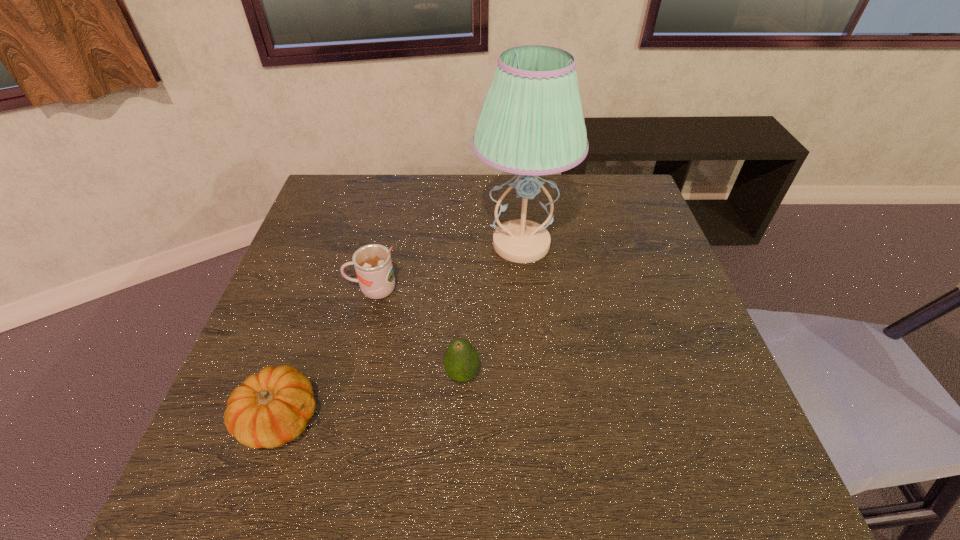
This screenshot has height=540, width=960. I want to click on object that is at the far edge, so click(x=531, y=123).

You are a GUI agent. You are given a task and a screenshot of the screen. Output one action in this format:
    pyautogui.click(x=<x>, y=<y>)
    Task: Click on the object positioned at the near edge
    The height and width of the screenshot is (540, 960).
    Given the screenshot: What is the action you would take?
    pyautogui.click(x=271, y=408)

Find the location of a particular element. object that is positioned at the left edge is located at coordinates (271, 408).

Where is `object at the near left corner`? The width and height of the screenshot is (960, 540). object at the near left corner is located at coordinates (271, 408).

Where is `vacant space at the far edge of the desktop`? This screenshot has width=960, height=540. vacant space at the far edge of the desktop is located at coordinates (413, 179).

Image resolution: width=960 pixels, height=540 pixels. In the image, there is a desktop. What are the coordinates of `blank space at the near edge` in the screenshot? It's located at (599, 491).

In the image, there is a desktop. At what (x,y) coordinates should I click in order to perform the action: click on vacant space at the left edge. Please return your answer as a coordinate pair (x, y). Looking at the image, I should click on (308, 307).

The image size is (960, 540). What are the coordinates of `free space at the right edge of the desktop` in the screenshot? It's located at (x=637, y=309).

Locate an element on the screen. blank area at the far left corner is located at coordinates (343, 207).

In the image, there is a desktop. What are the coordinates of `vacant space at the near right corner` in the screenshot? It's located at (736, 490).